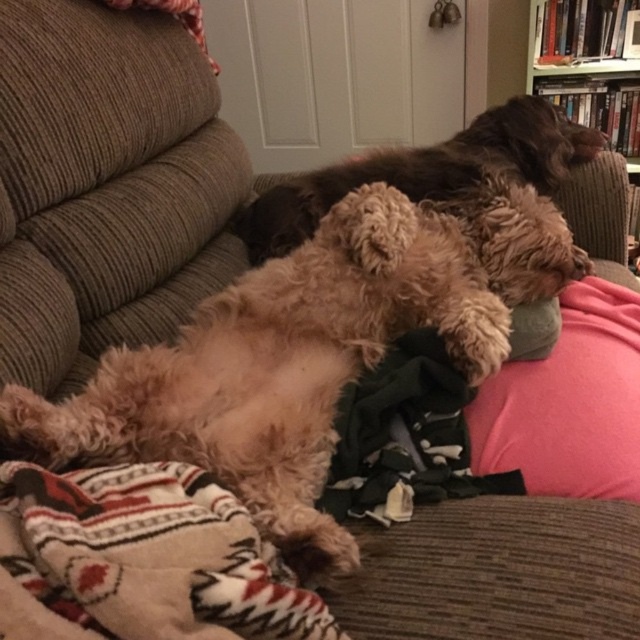
The height and width of the screenshot is (640, 640). Identify the location of knitted wool blanket at lower left. coord(140,561).

Can you confirm if knitted wool blanket at lower left is positioned below fuzzy brown dog at center?

Yes.

You are a GUI agent. You are given a task and a screenshot of the screen. Output one action in this format:
    pyautogui.click(x=<x>, y=<y>)
    Task: Click on the knitted wool blanket at lower left
    The height and width of the screenshot is (640, 640).
    Given the screenshot: What is the action you would take?
    pyautogui.click(x=140, y=561)

Where is `knitted wool blanket at lower left`? The width and height of the screenshot is (640, 640). knitted wool blanket at lower left is located at coordinates (140, 561).

Does point (125, 502) come closer to viewer compared to point (588, 104)?

Yes, point (125, 502) is in front of point (588, 104).

From the picture: Can you confirm if knitted wool blanket at lower left is positioned below wooden bookshelf at upper right?

Indeed, knitted wool blanket at lower left is positioned under wooden bookshelf at upper right.

The width and height of the screenshot is (640, 640). Find the location of `knitted wool blanket at lower left`. knitted wool blanket at lower left is located at coordinates (140, 561).

In the scene shown: Can you confirm if pink fabric pillow at center is smaller than wooden bookshelf at upper right?

Yes, pink fabric pillow at center is smaller than wooden bookshelf at upper right.

Does pink fabric pillow at center have a larger size compared to wooden bookshelf at upper right?

Actually, pink fabric pillow at center might be smaller than wooden bookshelf at upper right.

Where is `pink fabric pillow at center`? pink fabric pillow at center is located at coordinates (570, 403).

Identify the location of pink fabric pillow at center. Image resolution: width=640 pixels, height=640 pixels. (570, 403).